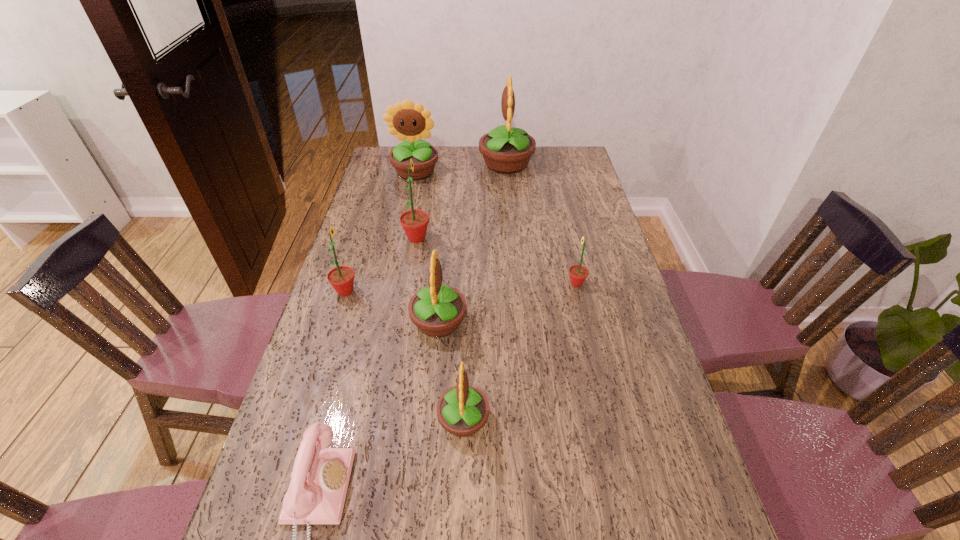
This screenshot has height=540, width=960. I want to click on free space between the smallest green sunflower and the biggest yellow sunflower, so click(541, 223).

This screenshot has height=540, width=960. Find the location of `vacant point located between the nearest yellow sunflower and the rightmost green sunflower`. vacant point located between the nearest yellow sunflower and the rightmost green sunflower is located at coordinates (520, 352).

Where is `unoccupied position between the leftmost green sunflower and the rightmost object`? The image size is (960, 540). unoccupied position between the leftmost green sunflower and the rightmost object is located at coordinates (461, 287).

Find the location of `blank region between the tallest object and the second smallest yellow sunflower`. blank region between the tallest object and the second smallest yellow sunflower is located at coordinates (472, 242).

Point out which object is positioned as the nearest to the second biggest yellow sunflower. Please provide its 2D coordinates. Your answer should be formatted as a tuple, i.e. [(x, y)], where the tuple contains the x and y coordinates of a point satisfying the conditions above.

[(506, 150)]

Select which object appears as the fifth closest to the sixth farthest object. Please provide its 2D coordinates. Your answer should be formatted as a tuple, i.e. [(x, y)], where the tuple contains the x and y coordinates of a point satisfying the conditions above.

[(578, 273)]

Select which sunflower appears as the fourth closest to the sixth farthest sunflower. Please provide its 2D coordinates. Your answer should be formatted as a tuple, i.e. [(x, y)], where the tuple contains the x and y coordinates of a point satisfying the conditions above.

[(578, 273)]

Find the location of a particular element. The image size is (960, 540). sunflower that is the fifth closest one to the third farthest object is located at coordinates (578, 273).

The height and width of the screenshot is (540, 960). Find the location of `the second closest yellow sunflower to the second smallest green sunflower`. the second closest yellow sunflower to the second smallest green sunflower is located at coordinates click(462, 410).

Locate which yellow sunflower ranks second in proximity to the rightmost sunflower. Please provide its 2D coordinates. Your answer should be formatted as a tuple, i.e. [(x, y)], where the tuple contains the x and y coordinates of a point satisfying the conditions above.

[(462, 410)]